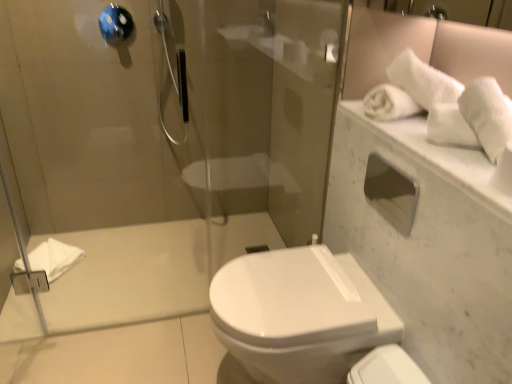
Question: Considering the relative positions of white marble mirror at upper right and white soft towel at upper right, which is the 1th bath towel in top-to-bottom order, in the image provided, is white marble mirror at upper right to the left of white soft towel at upper right, which is the 1th bath towel in top-to-bottom order, from the viewer's perspective?

Choices:
 (A) yes
 (B) no

Answer: (A)

Question: Is white marble mirror at upper right facing towards white soft towel at upper right, arranged as the 1th bath towel when viewed from the front?

Choices:
 (A) yes
 (B) no

Answer: (B)

Question: Does white marble mirror at upper right lie behind white soft towel at upper right, which ranks as the second bath towel in left-to-right order?

Choices:
 (A) no
 (B) yes

Answer: (A)

Question: Considering the relative sizes of white marble mirror at upper right and white soft towel at upper right, arranged as the 1th bath towel when viewed from the front, in the image provided, is white marble mirror at upper right shorter than white soft towel at upper right, arranged as the 1th bath towel when viewed from the front,?

Choices:
 (A) yes
 (B) no

Answer: (A)

Question: From the image's perspective, does white marble mirror at upper right appear lower than white soft towel at upper right, which is the 1th bath towel in top-to-bottom order?

Choices:
 (A) no
 (B) yes

Answer: (B)

Question: From the image's perspective, is white marble mirror at upper right located above white soft towel at upper right, arranged as the 1th bath towel when viewed from the front?

Choices:
 (A) no
 (B) yes

Answer: (A)

Question: Can you confirm if white marble mirror at upper right is taller than white glossy toilet at lower right?

Choices:
 (A) no
 (B) yes

Answer: (A)

Question: Is white marble mirror at upper right positioned in front of white glossy toilet at lower right?

Choices:
 (A) no
 (B) yes

Answer: (B)

Question: From a real-world perspective, does white marble mirror at upper right sit lower than white glossy toilet at lower right?

Choices:
 (A) no
 (B) yes

Answer: (A)

Question: From the image's perspective, is white marble mirror at upper right over white glossy toilet at lower right?

Choices:
 (A) yes
 (B) no

Answer: (A)

Question: Can you confirm if white marble mirror at upper right is thinner than white glossy toilet at lower right?

Choices:
 (A) no
 (B) yes

Answer: (A)

Question: From a real-world perspective, is white marble mirror at upper right physically above white glossy toilet at lower right?

Choices:
 (A) no
 (B) yes

Answer: (B)

Question: Is blue glossy towel bar at upper left a part of white matte towel at left, marked as the 2th bath towel in a front-to-back arrangement?

Choices:
 (A) no
 (B) yes

Answer: (A)